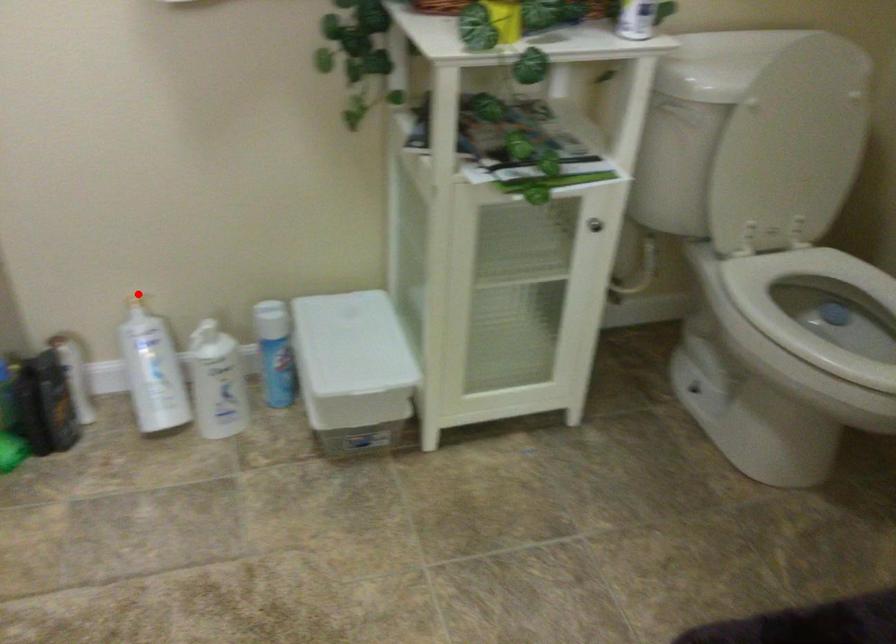
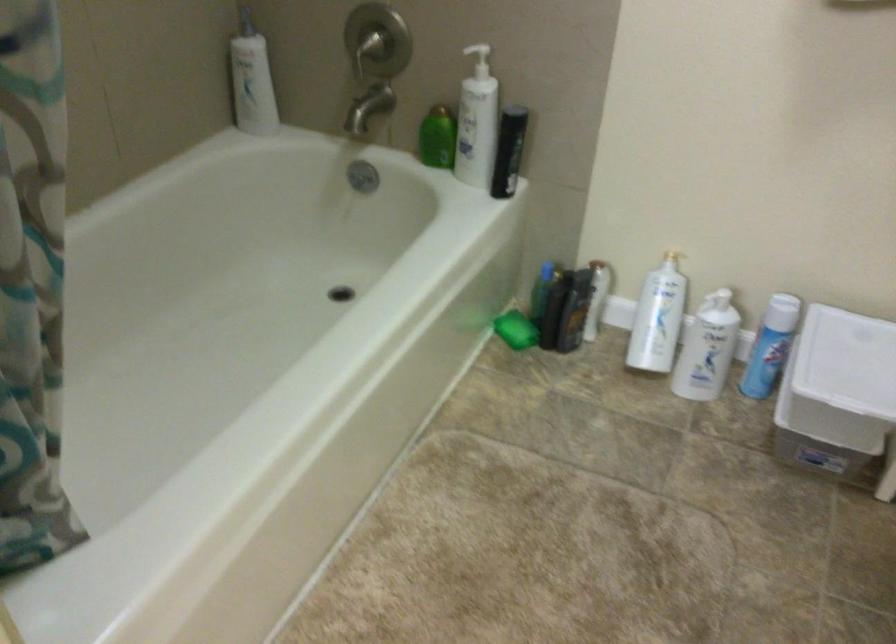
Question: I am providing you with two images of the same scene from different viewpoints. Image1 has a red point marked. In image2, the corresponding 3D location appears at what relative position? Reply with the corresponding letter.

Choices:
 (A) Closer
 (B) Farther

Answer: (B)